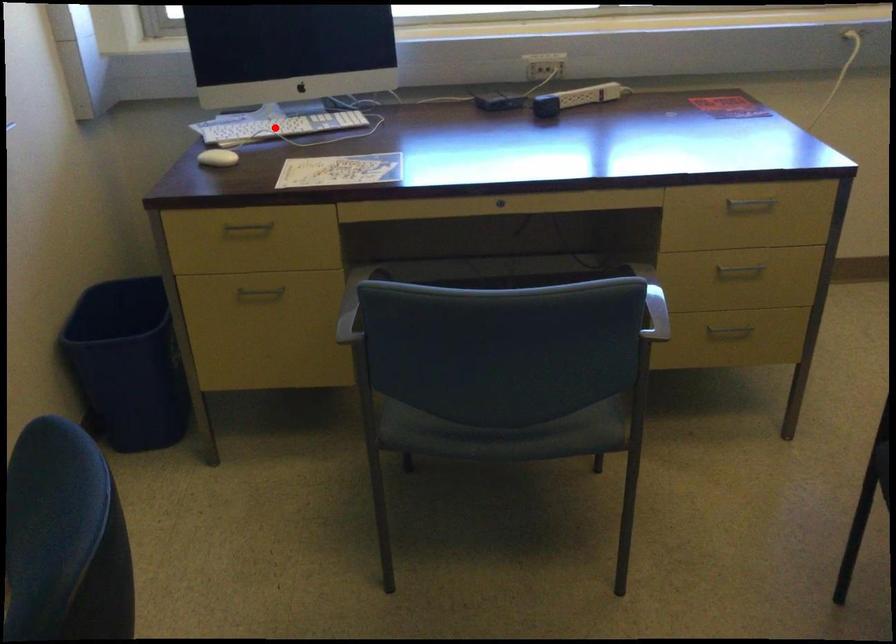
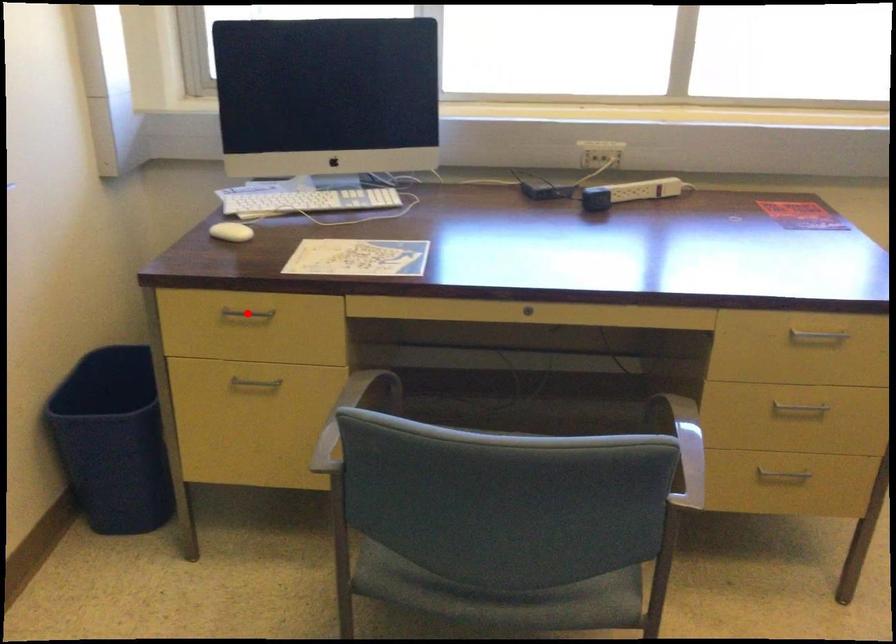
I am providing you with two images of the same scene from different viewpoints. A red point is marked on the first image and another point is marked on the second image. Does the point marked in image1 correspond to the same location as the one in image2?

No